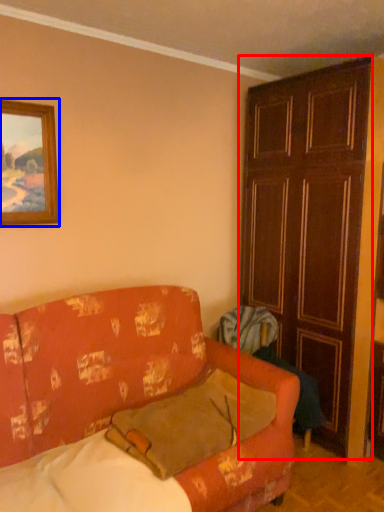
Question: Which object appears farthest to the camera in this image, door (highlighted by a red box) or picture frame (highlighted by a blue box)?

Choices:
 (A) door
 (B) picture frame

Answer: (A)